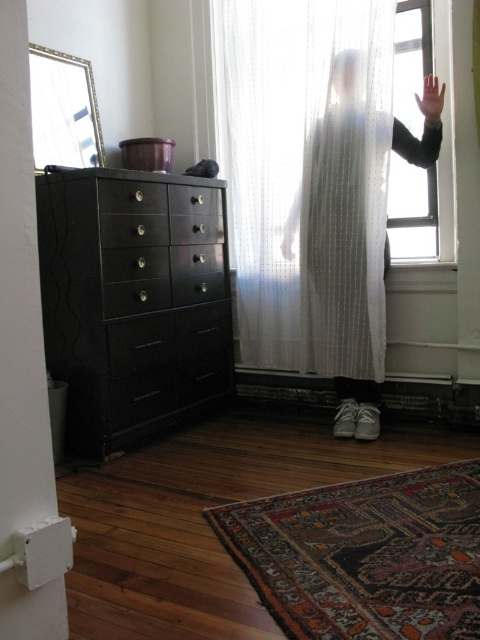
Question: Is transparent glass window at upper right thinner than translucent white hand at upper right?

Choices:
 (A) no
 (B) yes

Answer: (A)

Question: Which of the following is the closest to the observer?

Choices:
 (A) (284, 256)
 (B) (347, 120)

Answer: (B)

Question: Does matte black dresser at left appear on the left side of white sheer dress at center?

Choices:
 (A) no
 (B) yes

Answer: (B)

Question: Observing the image, what is the correct spatial positioning of white sheer dress at center in reference to black glossy drawer at left?

Choices:
 (A) above
 (B) below

Answer: (B)

Question: Which point is closer to the camera taking this photo?

Choices:
 (A) (355, 193)
 (B) (191, 340)
 (C) (403, 132)
 (D) (422, 99)

Answer: (D)

Question: Considering the real-world distances, which object is closest to the black glossy drawer at left?

Choices:
 (A) matte black dresser at left
 (B) white sheer dress at center

Answer: (A)